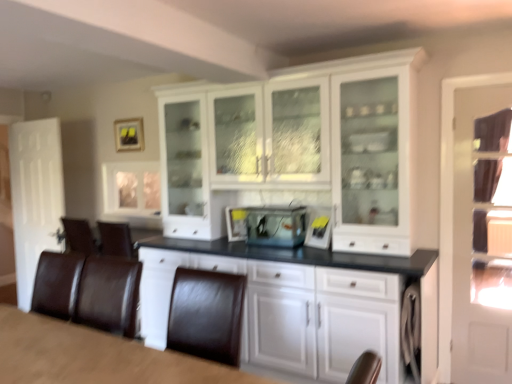
Where is `white matte door at left`? This screenshot has height=384, width=512. white matte door at left is located at coordinates (35, 197).

The height and width of the screenshot is (384, 512). Describe the element at coordinates (95, 356) in the screenshot. I see `brown leather table at lower left` at that location.

In order to face matte black picture frame at upper center, should I rotate leftwards or rightwards?

You should rotate left by 16.458 degrees.

The image size is (512, 384). Find the location of `white matte door at left`. white matte door at left is located at coordinates 35,197.

Where is `window on the left of the white glossy cabinet at center`? window on the left of the white glossy cabinet at center is located at coordinates (131, 188).

Can you confirm if clear glass cabinet at upper left is bigger than white glossy cabinet at center?

No, clear glass cabinet at upper left is not bigger than white glossy cabinet at center.

Which is nearer, (104,210) or (178,199)?

The point (178,199) is in front.

How many degrees apart are the facing directions of clear glass cabinet at upper left and white glossy cabinet at center?

There is a 0.567-degree angle between the facing directions of clear glass cabinet at upper left and white glossy cabinet at center.

Based on the photo, considering the relative sizes of clear glass fish tank at center and gray fabric at lower right in the image provided, is clear glass fish tank at center shorter than gray fabric at lower right?

Indeed, clear glass fish tank at center has a lesser height compared to gray fabric at lower right.

Where is `dish washer located on the right of clear glass fish tank at center`? The width and height of the screenshot is (512, 384). dish washer located on the right of clear glass fish tank at center is located at coordinates (411, 328).

Between point (273, 217) and point (419, 321), which one is positioned behind?

Positioned behind is point (273, 217).

Considering the positions of point (128, 121) and point (23, 254), is point (128, 121) closer or farther from the camera than point (23, 254)?

Clearly, point (128, 121) is closer to the camera than point (23, 254).

Would you say matte black picture frame at upper center is inside or outside white matte door at left?

matte black picture frame at upper center exists outside the volume of white matte door at left.

Considering the sizes of objects brown leather table at lower left and clear glass cabinet at upper left in the image provided, who is shorter, brown leather table at lower left or clear glass cabinet at upper left?

With less height is brown leather table at lower left.

From a real-world perspective, who is located lower, brown leather table at lower left or clear glass cabinet at upper left?

In real-world perspective, brown leather table at lower left is lower.

From the image's perspective, which is below, brown leather table at lower left or clear glass cabinet at upper left?

brown leather table at lower left, from the image's perspective.

Between brown leather table at lower left and clear glass cabinet at upper left, which one has smaller width?

Thinner between the two is clear glass cabinet at upper left.

Considering the relative positions of matte black picture frame at upper center and gray fabric at lower right in the image provided, is matte black picture frame at upper center to the left of gray fabric at lower right from the viewer's perspective?

Yes.

Are matte black picture frame at upper center and gray fabric at lower right located far from each other?

matte black picture frame at upper center is far away from gray fabric at lower right.

Is matte black picture frame at upper center bigger than gray fabric at lower right?

Incorrect, matte black picture frame at upper center is not larger than gray fabric at lower right.

Is white matte door at left in front of or behind gray fabric at lower right in the image?

white matte door at left is behind gray fabric at lower right.

Who is smaller, white matte door at left or gray fabric at lower right?

gray fabric at lower right.

How different are the orientations of white matte door at left and gray fabric at lower right in degrees?

white matte door at left and gray fabric at lower right are facing 4.22 degrees away from each other.

From a real-world perspective, is white glossy cabinet at center positioned above or below white matte door at left?

white glossy cabinet at center is above white matte door at left.

Who is taller, white glossy cabinet at center or white matte door at left?

white glossy cabinet at center.

Considering the positions of objects white glossy cabinet at center and white matte door at left in the image provided, who is more to the right, white glossy cabinet at center or white matte door at left?

white glossy cabinet at center.

Is white glossy cabinet at center surrounding white matte door at left?

No.

Identify the location of window positioned vertically above the white glossy cabinet at center (from a real-world perspective). This screenshot has width=512, height=384. (131, 188).

What are the coordinates of `dish washer below the clear glass fish tank at center (from a real-world perspective)` in the screenshot? It's located at (411, 328).

Based on their spatial positions, is white glossy cabinet at center or clear glass fish tank at center closer to white matte door at left?

white glossy cabinet at center lies closer to white matte door at left than the other object.

When comparing their distances from clear glass door at right, does white glossy cabinet at center or clear glass fish tank at center seem further?

clear glass fish tank at center.

Based on their spatial positions, is clear glass cabinet at upper left or clear glass door at right closer to brown leather table at lower left?

clear glass cabinet at upper left.

Based on their spatial positions, is matte black picture frame at upper center or white matte door at left closer to brown leather table at lower left?

The object closer to brown leather table at lower left is white matte door at left.

From the image, which object appears to be nearer to gray fabric at lower right, brown leather table at lower left or white glossy cabinet at center?

The object closer to gray fabric at lower right is white glossy cabinet at center.

Estimate the real-world distances between objects in this image. Which object is further from white matte door at left, white glossy cabinet at center or clear glass door at right?

clear glass door at right is further to white matte door at left.

Estimate the real-world distances between objects in this image. Which object is further from brown leather table at lower left, white glossy cabinet at center or clear glass fish tank at center?

white glossy cabinet at center is positioned further to the anchor brown leather table at lower left.

From the image, which object appears to be nearer to white matte door at left, gray fabric at lower right or clear glass cabinet at upper left?

clear glass cabinet at upper left.

Locate an element on the screen. picture frame located between white matte door at left and white glossy cabinet at center in the left-right direction is located at coordinates (129, 134).

Image resolution: width=512 pixels, height=384 pixels. Identify the location of appliance between clear glass cabinet at upper left and clear glass door at right. (267, 225).

Where is `picture frame between white matte door at left and gray fabric at lower right from left to right`? The image size is (512, 384). picture frame between white matte door at left and gray fabric at lower right from left to right is located at coordinates (129, 134).

What are the coordinates of `cabinetry between brown leather table at lower left and white matte door at left in the front-back direction` in the screenshot? It's located at (297, 147).